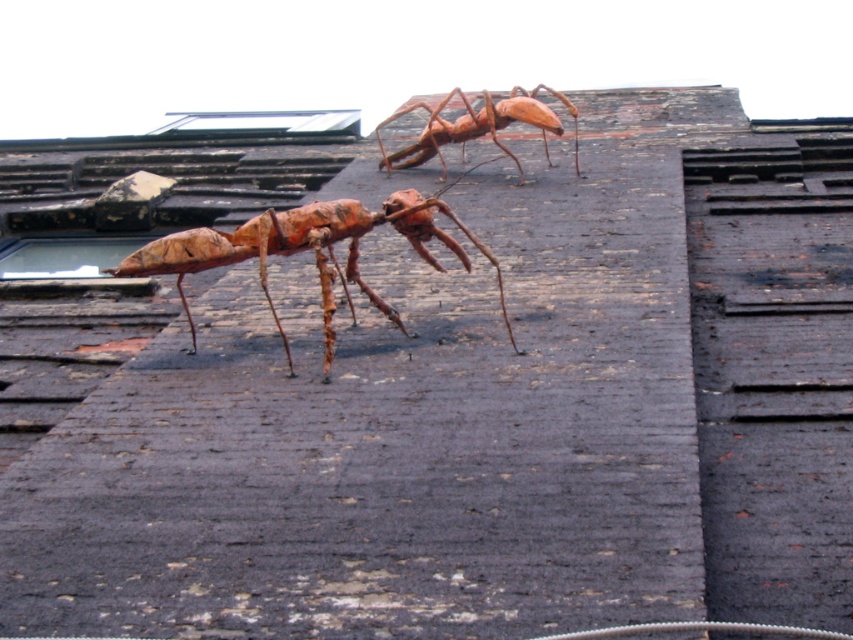
Question: Which point is farther to the camera?

Choices:
 (A) (410, 164)
 (B) (314, 211)

Answer: (A)

Question: Is rustic wood insect at center bigger than rustic wood ant at upper center?

Choices:
 (A) no
 (B) yes

Answer: (A)

Question: From the image, what is the correct spatial relationship of rustic wood insect at center in relation to rustic wood ant at upper center?

Choices:
 (A) left
 (B) right

Answer: (A)

Question: In this image, where is rustic wood insect at center located relative to rustic wood ant at upper center?

Choices:
 (A) left
 (B) right

Answer: (A)